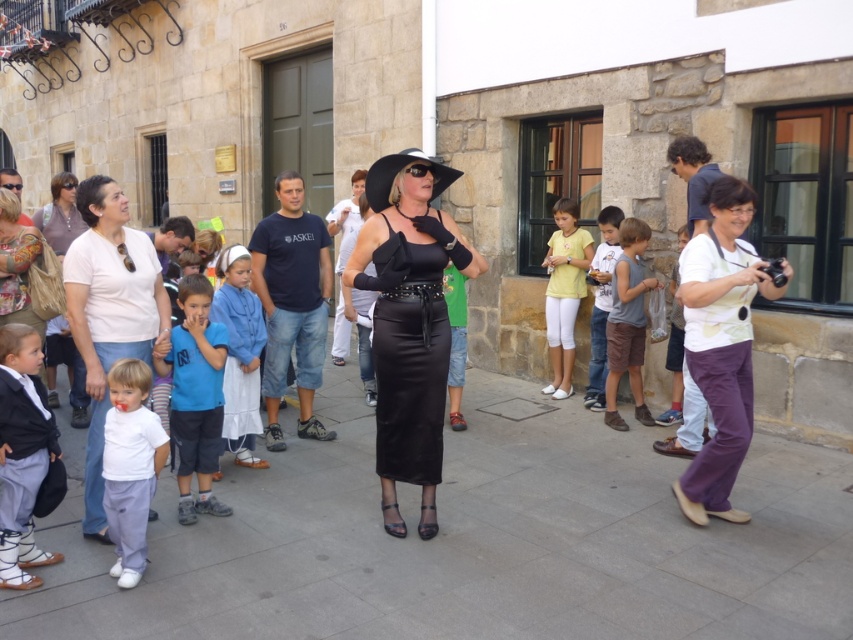
Is white matte shirt at left further to the viewer compared to white cotton shirt at left?

Yes, white matte shirt at left is further from the viewer.

Describe the element at coordinates (109, 312) in the screenshot. The width and height of the screenshot is (853, 640). I see `white matte shirt at left` at that location.

Is point (126, 307) less distant than point (24, 378)?

No, (126, 307) is further to viewer.

I want to click on white matte shirt at left, so click(x=109, y=312).

Is black leather dress at center to the right of white matte shirt at lower left from the viewer's perspective?

Yes, black leather dress at center is to the right of white matte shirt at lower left.

Is black leather dress at center shorter than white matte shirt at lower left?

Incorrect, black leather dress at center's height does not fall short of white matte shirt at lower left's.

Is point (425, 460) farther from viewer compared to point (123, 544)?

Yes, point (425, 460) is farther from viewer.

At what (x,y) coordinates should I click in order to perform the action: click on black leather dress at center. Please return your answer as a coordinate pair (x, y). This screenshot has width=853, height=640. Looking at the image, I should click on (410, 349).

Can you confirm if black leather dress at center is taller than brown cotton shorts at center-right?

No.

Does black leather dress at center appear on the right side of brown cotton shorts at center-right?

Incorrect, black leather dress at center is not on the right side of brown cotton shorts at center-right.

Which is behind, point (433, 384) or point (635, 406)?

The point (635, 406) is more distant.

Image resolution: width=853 pixels, height=640 pixels. Find the location of `black leather dress at center`. black leather dress at center is located at coordinates (410, 349).